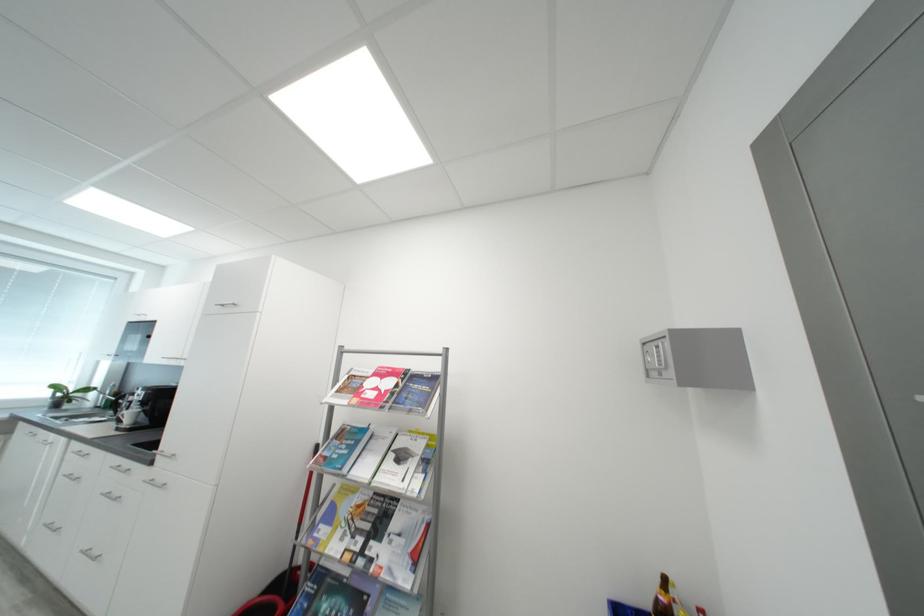
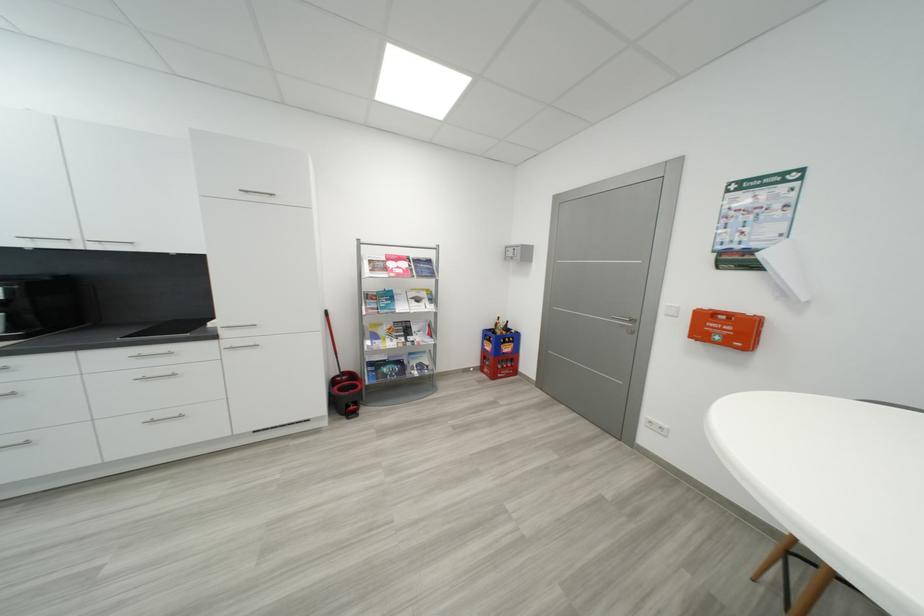
Locate, in the second image, the point that corresponds to (403,525) in the first image.

(421, 330)